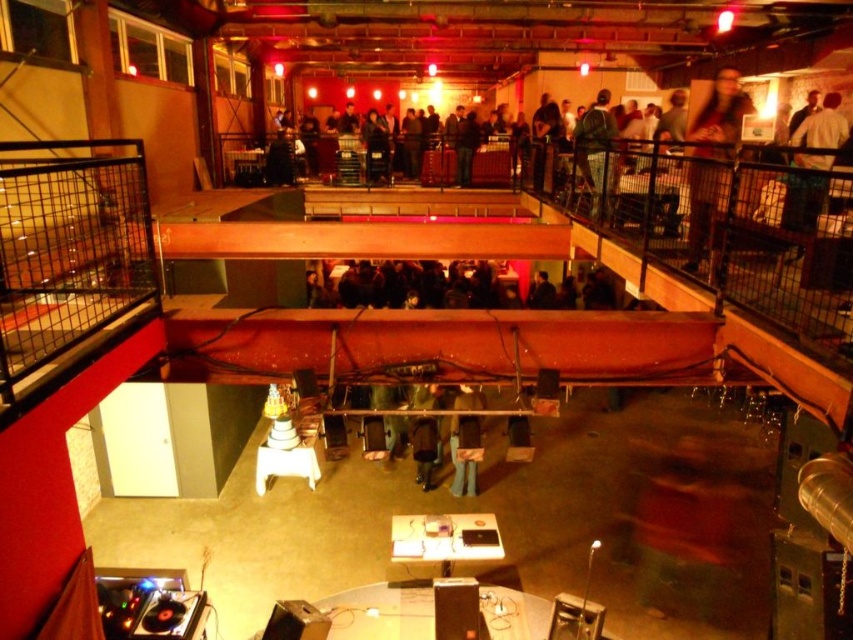
Does point (819, 145) come behind point (605, 148)?

Yes.

Does light brown leather jacket at upper right appear on the left side of dark gray jacket at upper right?

In fact, light brown leather jacket at upper right is to the right of dark gray jacket at upper right.

This screenshot has height=640, width=853. I want to click on light brown leather jacket at upper right, so (822, 125).

Does point (714, 209) come closer to viewer compared to point (811, 176)?

No.

Is brown fuzzy coat at upper right bigger than light brown leather jacket at upper right?

Yes, brown fuzzy coat at upper right is bigger than light brown leather jacket at upper right.

Is point (752, 106) more distant than point (809, 227)?

Yes, point (752, 106) is farther from viewer.

The height and width of the screenshot is (640, 853). I want to click on brown fuzzy coat at upper right, so click(x=701, y=200).

Between brown fuzzy coat at upper right and dark gray jacket at upper right, which one appears on the left side from the viewer's perspective?

From the viewer's perspective, dark gray jacket at upper right appears more on the left side.

Does point (718, 129) come behind point (590, 179)?

No, (718, 129) is closer to viewer.

Locate an element on the screen. This screenshot has width=853, height=640. brown fuzzy coat at upper right is located at coordinates (701, 200).

Locate an element on the screen. The width and height of the screenshot is (853, 640). brown fuzzy coat at upper right is located at coordinates (701, 200).